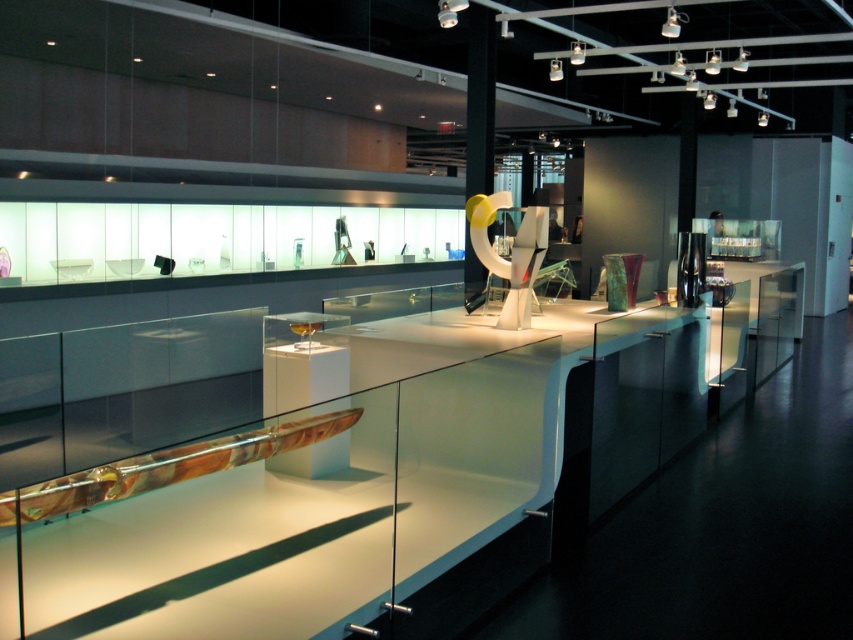
Question: Which of the following is the closest to the observer?

Choices:
 (A) (682, 400)
 (B) (479, 198)

Answer: (B)

Question: Is white glossy counter top at center in front of translucent glass sculpture at center?

Choices:
 (A) no
 (B) yes

Answer: (B)

Question: Is white glossy counter top at center behind translucent glass sculpture at center?

Choices:
 (A) yes
 (B) no

Answer: (B)

Question: Can you confirm if white glossy counter top at center is thinner than translucent glass sculpture at center?

Choices:
 (A) no
 (B) yes

Answer: (A)

Question: Which point appears farthest from the camera in this image?

Choices:
 (A) (424, 609)
 (B) (480, 218)

Answer: (B)

Question: Which point appears farthest from the camera in this image?

Choices:
 (A) click(483, 227)
 (B) click(532, 531)

Answer: (A)